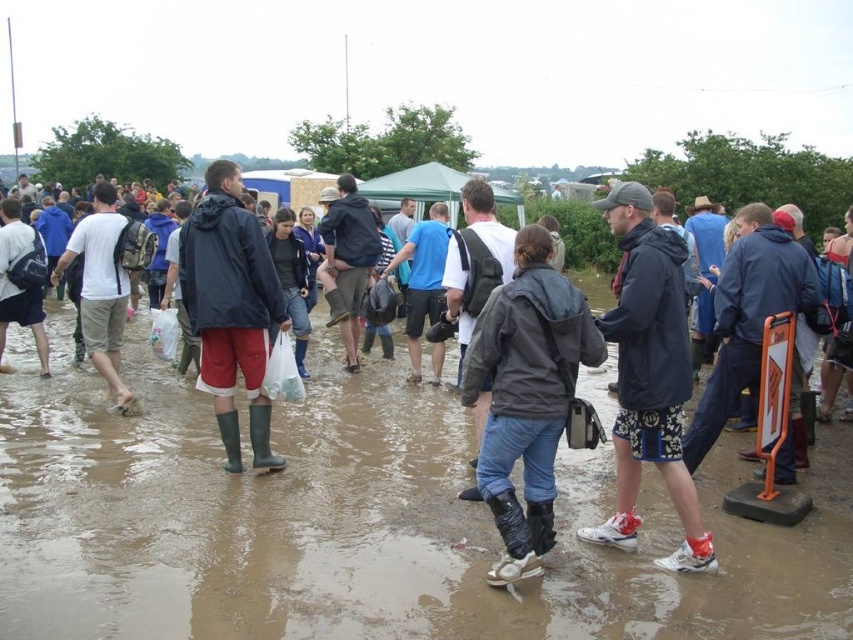
You are attending an outdoor event and see the brown muddy ground at center and the dark gray matte jacket at center. Which object is closer to the ground?

The brown muddy ground at center is below the dark gray matte jacket at center, so the brown muddy ground at center is closer to the ground.

You are standing at the origin point in the image. Which direction should you move to reach the brown muddy ground at center?

The brown muddy ground at center is located at point 0.825 on the x axis and 0.408 on the y axis. Since you are at the origin point, you should move right along the x axis to 0.825 and up along the y axis to 0.408 to reach it.